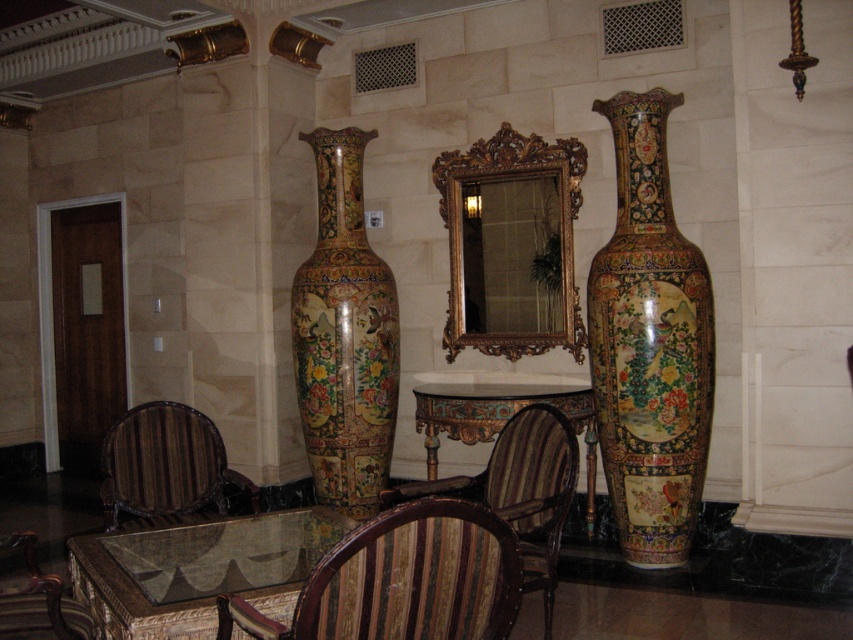
You are a guest in this room and need to choose between the striped fabric chair at lower left and the wooden polished chair at lower left. Which chair has a wider seating area?

The striped fabric chair at lower left has a wider seating area than the wooden polished chair at lower left according to the description.

Consider the image. You are sitting on a striped fabric chair at center. A small is placed at point [520,490]. Where is the small located relative to your current position?

The small is located at point [520,490] on striped fabric chair at center.

You are a guest entering the room and want to sit down. Which object, the striped fabric chair at center or the carved wood table at center, is more suitable for sitting?

The striped fabric chair at center is more suitable for sitting because it has a larger size compared to the carved wood table at center.